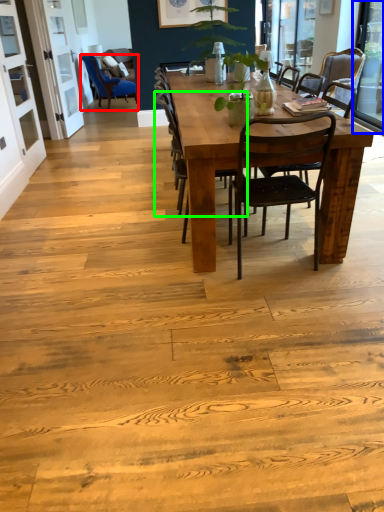
Question: Which object is positioned closest to chair (highlighted by a red box)? Select from window screen (highlighted by a blue box) and chair (highlighted by a green box).

Choices:
 (A) window screen
 (B) chair

Answer: (A)